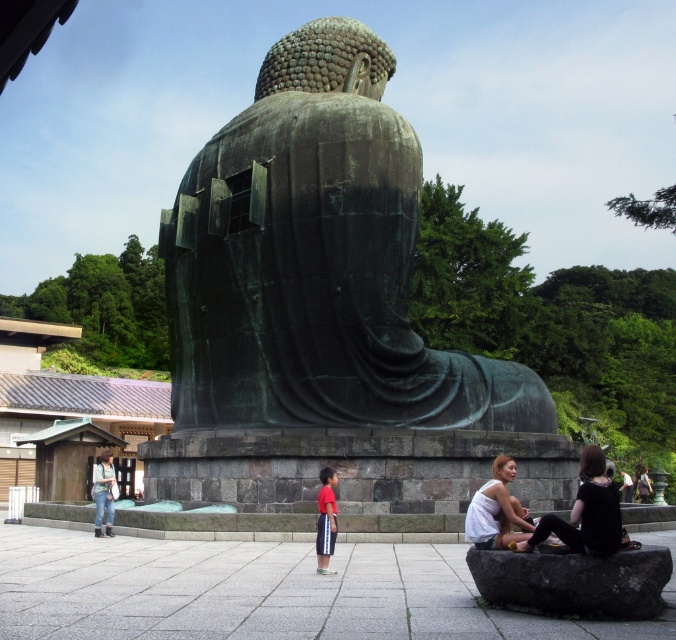
Is green patina bronze statue at center smaller than red cotton shorts at center?

Incorrect, green patina bronze statue at center is not smaller in size than red cotton shorts at center.

Does green patina bronze statue at center appear on the right side of red cotton shorts at center?

No, green patina bronze statue at center is not to the right of red cotton shorts at center.

Measure the distance between point (237,141) and camera.

Point (237,141) is 43.88 meters away from camera.

In order to click on green patina bronze statue at center in this screenshot , I will do click(316, 262).

Can you confirm if white matte shirt at lower right is smaller than red cotton shorts at center?

Actually, white matte shirt at lower right might be larger than red cotton shorts at center.

Does white matte shirt at lower right lie in front of red cotton shorts at center?

Yes, white matte shirt at lower right is closer to the viewer.

Identify the location of white matte shirt at lower right. tap(496, 509).

What do you see at coordinates (316, 262) in the screenshot?
I see `green patina bronze statue at center` at bounding box center [316, 262].

Between green patina bronze statue at center and black fabric dress at lower right, which one is positioned higher?

green patina bronze statue at center is above.

Between point (338, 131) and point (598, 464), which one is positioned in front?

Point (598, 464) is in front.

You are a GUI agent. You are given a task and a screenshot of the screen. Output one action in this format:
    pyautogui.click(x=<x>, y=<y>)
    Task: Click on the green patina bronze statue at center
    
    Given the screenshot: What is the action you would take?
    pyautogui.click(x=316, y=262)